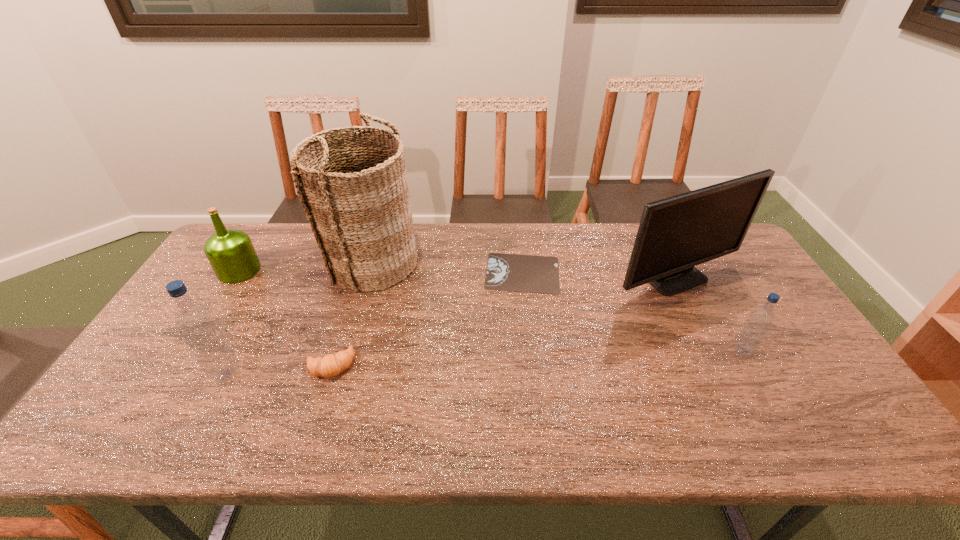
Locate an element on the screen. olive oil situated at the far edge is located at coordinates (230, 252).

Find the location of a particular element. water bottle present at the near edge is located at coordinates (196, 323).

Identify the location of crescent roll situated at the near edge. (330, 365).

The width and height of the screenshot is (960, 540). What are the coordinates of `object located in the left edge section of the desktop` in the screenshot? It's located at (230, 252).

Image resolution: width=960 pixels, height=540 pixels. I want to click on water bottle present at the right edge, so click(760, 320).

Where is `computer monitor situated at the right edge`? computer monitor situated at the right edge is located at coordinates (675, 234).

Identify the location of object present at the far left corner. The image size is (960, 540). (230, 252).

Find the location of a particular element. The height and width of the screenshot is (540, 960). object that is at the far right corner is located at coordinates (x=675, y=234).

The width and height of the screenshot is (960, 540). In the image, there is a desktop. Find the location of `vacant region at the far edge`. vacant region at the far edge is located at coordinates (595, 259).

The height and width of the screenshot is (540, 960). In the image, there is a desktop. Identify the location of free space at the near edge. (609, 394).